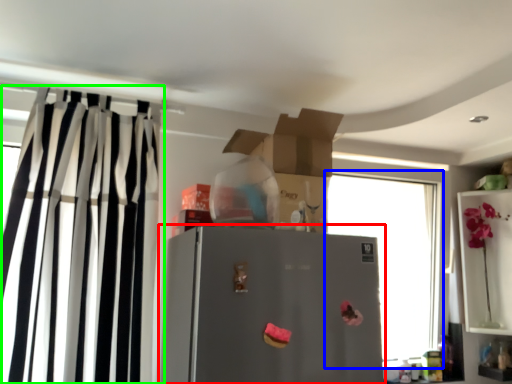
Question: Which object is positioned farthest from refrigerator (highlighted by a red box)? Select from window (highlighted by a blue box) and curtain (highlighted by a green box).

Choices:
 (A) window
 (B) curtain

Answer: (A)